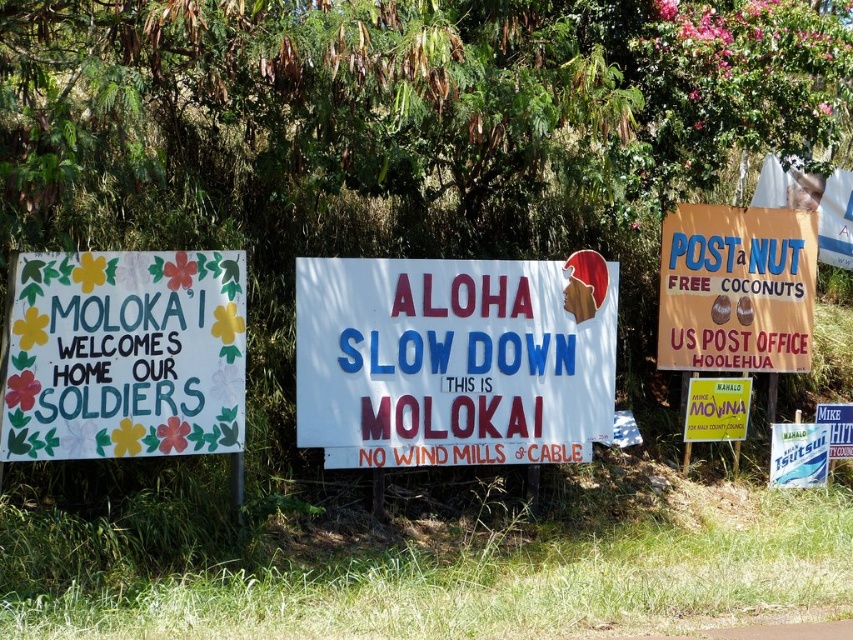
The image size is (853, 640). I want to click on matte floral signboard at left, so click(x=125, y=355).

Is matte floral signboard at left to the left of yellow paper sign at center from the viewer's perspective?

Indeed, matte floral signboard at left is positioned on the left side of yellow paper sign at center.

At what (x,y) coordinates should I click in order to perform the action: click on matte floral signboard at left. Please return your answer as a coordinate pair (x, y). This screenshot has height=640, width=853. Looking at the image, I should click on (125, 355).

The height and width of the screenshot is (640, 853). In order to click on matte floral signboard at left in this screenshot , I will do `click(125, 355)`.

Looking at this image, between matte floral signboard at left and blue cardboard sign at right, which one appears on the left side from the viewer's perspective?

From the viewer's perspective, matte floral signboard at left appears more on the left side.

Does point (186, 422) come in front of point (796, 268)?

Yes, point (186, 422) is closer to viewer.

In order to click on matte floral signboard at left in this screenshot , I will do `click(125, 355)`.

Measure the distance between blue cardboard sign at right and yellow paper sign at center.

25.05 inches

Between blue cardboard sign at right and yellow paper sign at center, which one is positioned lower?

yellow paper sign at center is below.

Find the location of `blue cardboard sign at right`. blue cardboard sign at right is located at coordinates (735, 289).

Identify the location of blue cardboard sign at right. The width and height of the screenshot is (853, 640). (735, 289).